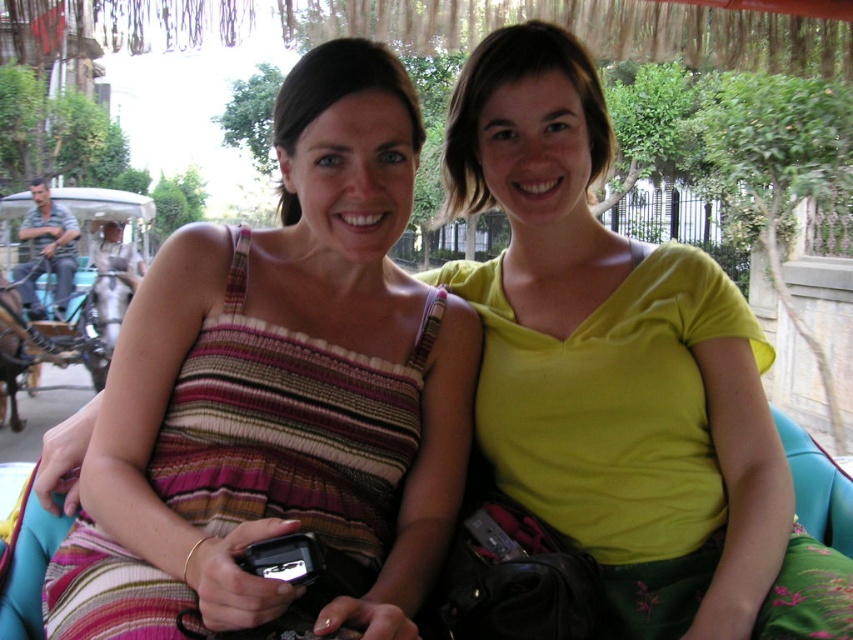
Based on the photo, is yellow matte shirt at center to the right of brushed metal coach at left from the viewer's perspective?

Yes, yellow matte shirt at center is to the right of brushed metal coach at left.

Identify the location of yellow matte shirt at center. (622, 371).

Does point (448, 166) come behind point (59, 284)?

That is False.

The image size is (853, 640). Identify the location of yellow matte shirt at center. [x=622, y=371].

Looking at this image, between striped fabric dress at center and brushed metal coach at left, which one has more height?

Standing taller between the two is brushed metal coach at left.

Is striped fabric dress at center wider than brushed metal coach at left?

In fact, striped fabric dress at center might be narrower than brushed metal coach at left.

Describe the element at coordinates (280, 390) in the screenshot. I see `striped fabric dress at center` at that location.

At what (x,y) coordinates should I click in order to perform the action: click on striped fabric dress at center. Please return your answer as a coordinate pair (x, y). The image size is (853, 640). Looking at the image, I should click on (280, 390).

Does brushed metal coach at left lie behind black plastic phone at center?

Yes, it is behind black plastic phone at center.

Does brushed metal coach at left have a greater height compared to black plastic phone at center?

Correct, brushed metal coach at left is much taller as black plastic phone at center.

This screenshot has height=640, width=853. I want to click on brushed metal coach at left, so click(x=45, y=250).

This screenshot has height=640, width=853. Identify the location of brushed metal coach at left. (45, 250).